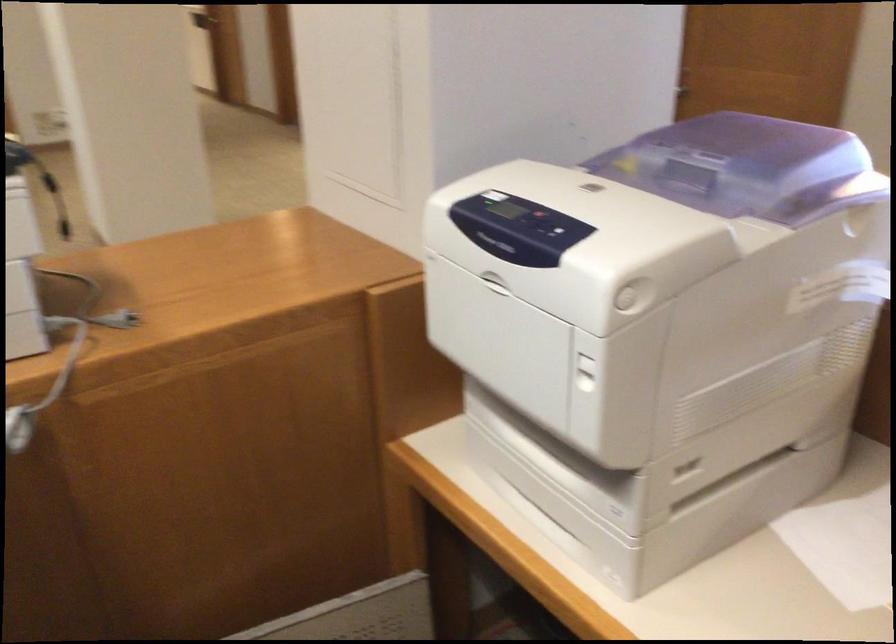
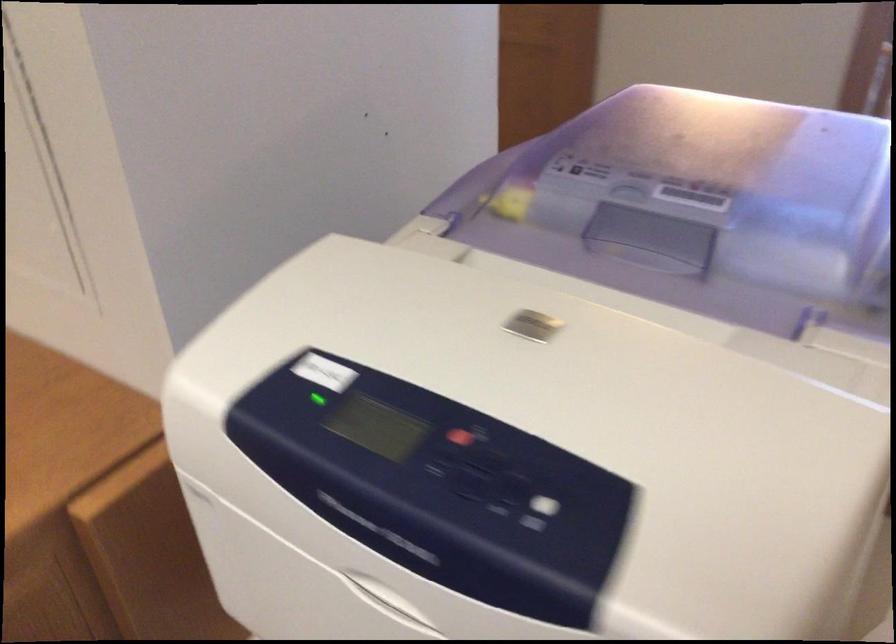
Locate, in the second image, the point that corresponds to point (561, 234) in the first image.

(538, 512)